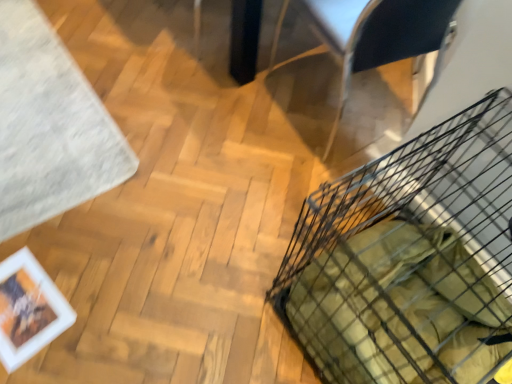
I want to click on unoccupied region to the right of white soft rug at upper left, so click(x=187, y=136).